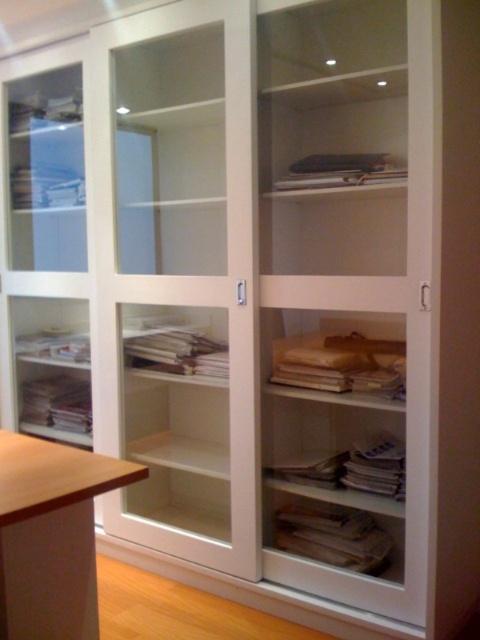
Is transparent glass cabinet at center thinner than wooden stool at lower left?

No.

Is transparent glass cabinet at center taller than wooden stool at lower left?

Yes, transparent glass cabinet at center is taller than wooden stool at lower left.

Locate an element on the screen. The width and height of the screenshot is (480, 640). transparent glass cabinet at center is located at coordinates (178, 276).